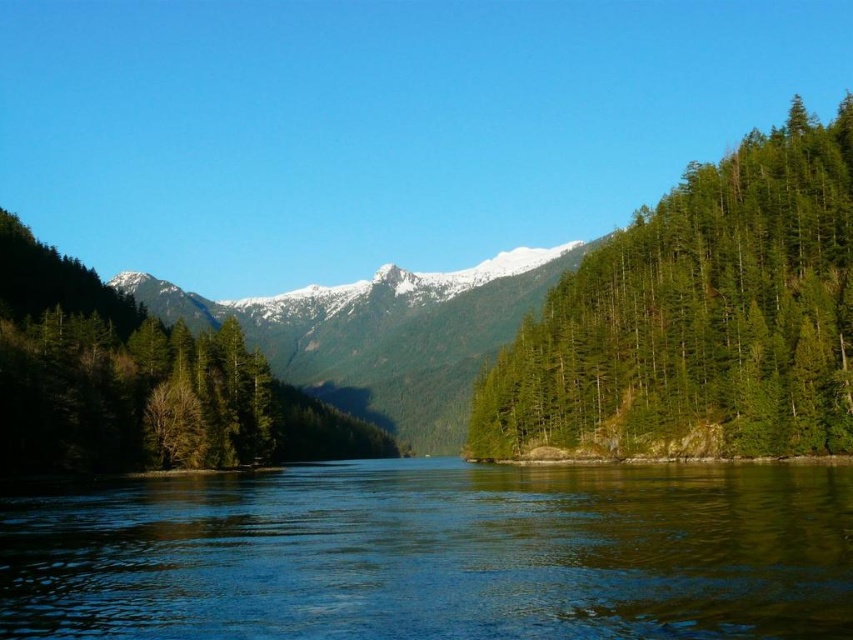
Question: Considering the relative positions of green reflective water at center and snowy rocky mountain at center in the image provided, where is green reflective water at center located with respect to snowy rocky mountain at center?

Choices:
 (A) left
 (B) right

Answer: (B)

Question: Which point is closer to the camera?

Choices:
 (A) snowy rocky mountain at center
 (B) green reflective water at center
 (C) green textured forest at right
 (D) green matte tree at center

Answer: (B)

Question: Does green textured forest at right come behind green matte tree at center?

Choices:
 (A) yes
 (B) no

Answer: (B)

Question: Estimate the real-world distances between objects in this image. Which object is closer to the green matte tree at center?

Choices:
 (A) green reflective water at center
 (B) green textured forest at right
 (C) snowy rocky mountain at center

Answer: (A)

Question: Which of these objects is positioned farthest from the snowy rocky mountain at center?

Choices:
 (A) green textured forest at right
 (B) green matte tree at center
 (C) green reflective water at center

Answer: (C)

Question: Where is green textured forest at right located in relation to snowy rocky mountain at center in the image?

Choices:
 (A) left
 (B) right

Answer: (B)